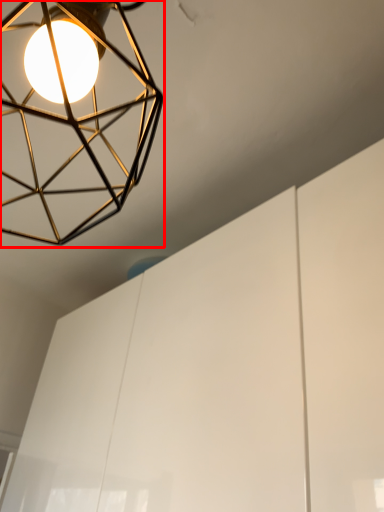
Question: Observing the image, what is the correct spatial positioning of lamp (annotated by the red box) in reference to cabinetry?

Choices:
 (A) right
 (B) left

Answer: (B)